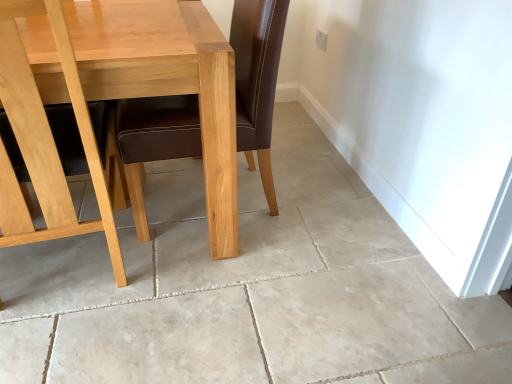
Question: From the image's perspective, is light brown wood table at center positioned above or below light brown wood chair at left?

Choices:
 (A) below
 (B) above

Answer: (B)

Question: Does point (206, 66) appear closer or farther from the camera than point (65, 33)?

Choices:
 (A) closer
 (B) farther

Answer: (B)

Question: Which object is positioned closest to the beige tile floor at center?

Choices:
 (A) light brown wood table at center
 (B) light brown wood chair at left

Answer: (B)

Question: Which of these objects is positioned farthest from the light brown wood table at center?

Choices:
 (A) beige tile floor at center
 (B) light brown wood chair at left

Answer: (A)